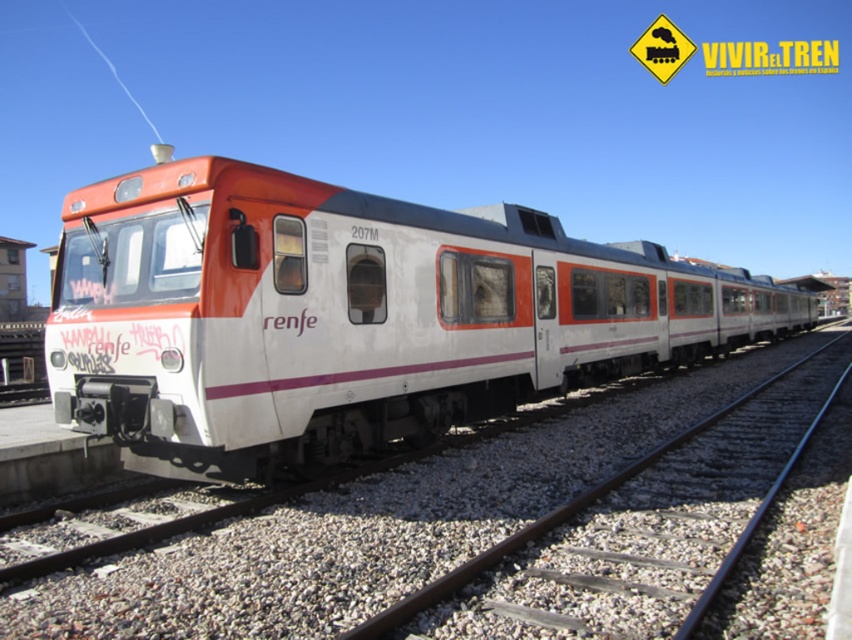
Question: Is white matte train at center smaller than metal at center?

Choices:
 (A) no
 (B) yes

Answer: (A)

Question: Which point appears farthest from the camera in this image?

Choices:
 (A) (603, 584)
 (B) (148, 259)

Answer: (B)

Question: Does white matte train at center appear under metal at center?

Choices:
 (A) yes
 (B) no

Answer: (B)

Question: Where is white matte train at center located in relation to metal at center in the image?

Choices:
 (A) left
 (B) right

Answer: (B)